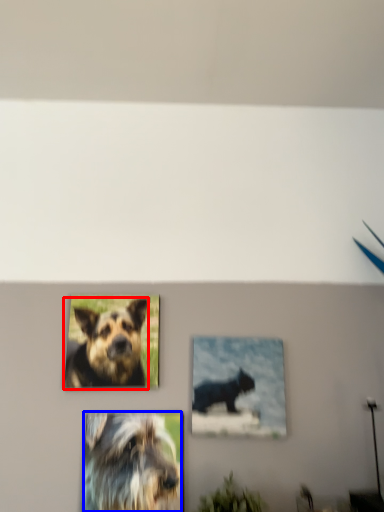
Question: Which point is further to the camera, dog (highlighted by a red box) or dog (highlighted by a blue box)?

Choices:
 (A) dog
 (B) dog

Answer: (A)